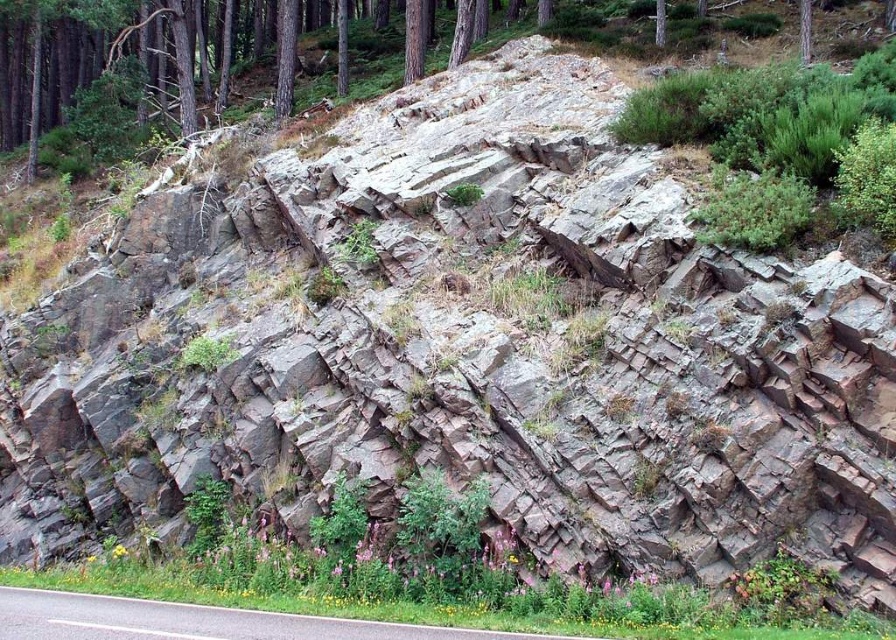
Question: Which point is farther to the camera?

Choices:
 (A) smooth bark tree at upper right
 (B) asphalt road at lower left

Answer: (A)

Question: Does asphalt road at lower left lie in front of smooth bark tree at upper right?

Choices:
 (A) yes
 (B) no

Answer: (A)

Question: Which point is closer to the camera?

Choices:
 (A) (802, 19)
 (B) (314, 624)

Answer: (B)

Question: From the image, what is the correct spatial relationship of asphalt road at lower left in relation to smooth bark tree at upper right?

Choices:
 (A) right
 (B) left

Answer: (B)

Question: Among these objects, which one is farthest from the camera?

Choices:
 (A) smooth bark tree at upper right
 (B) asphalt road at lower left

Answer: (A)

Question: Considering the relative positions of asphalt road at lower left and smooth bark tree at upper right in the image provided, where is asphalt road at lower left located with respect to smooth bark tree at upper right?

Choices:
 (A) above
 (B) below

Answer: (B)